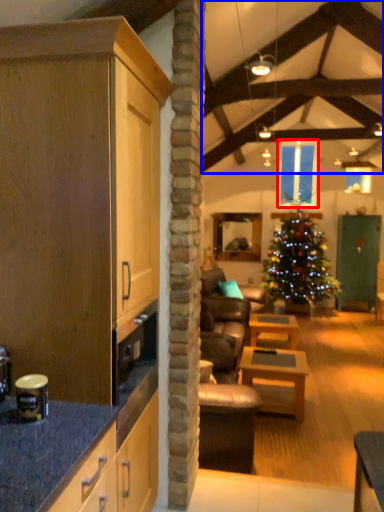
Question: Which of the following is the farthest to the observer, window (highlighted by a red box) or exhaust hood (highlighted by a blue box)?

Choices:
 (A) window
 (B) exhaust hood

Answer: (A)